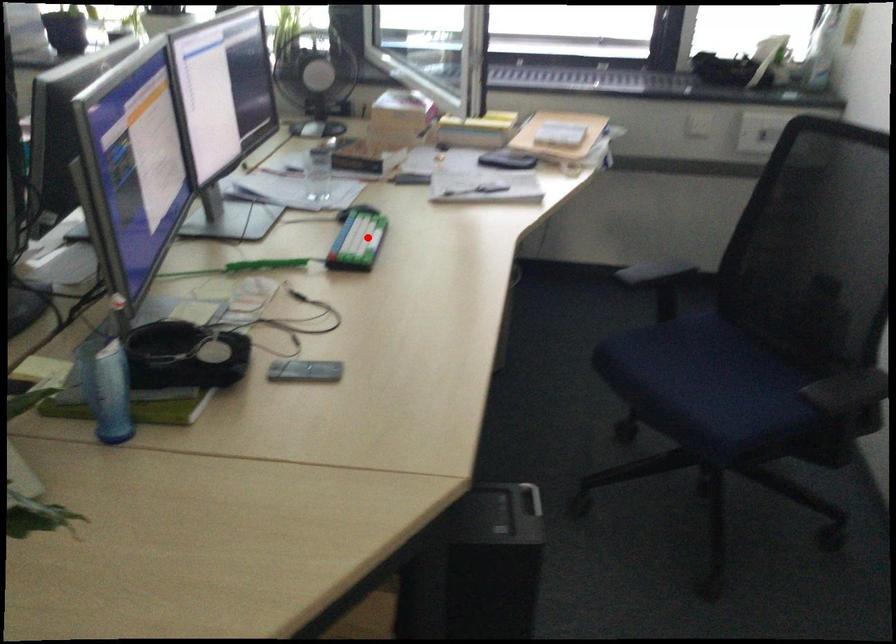
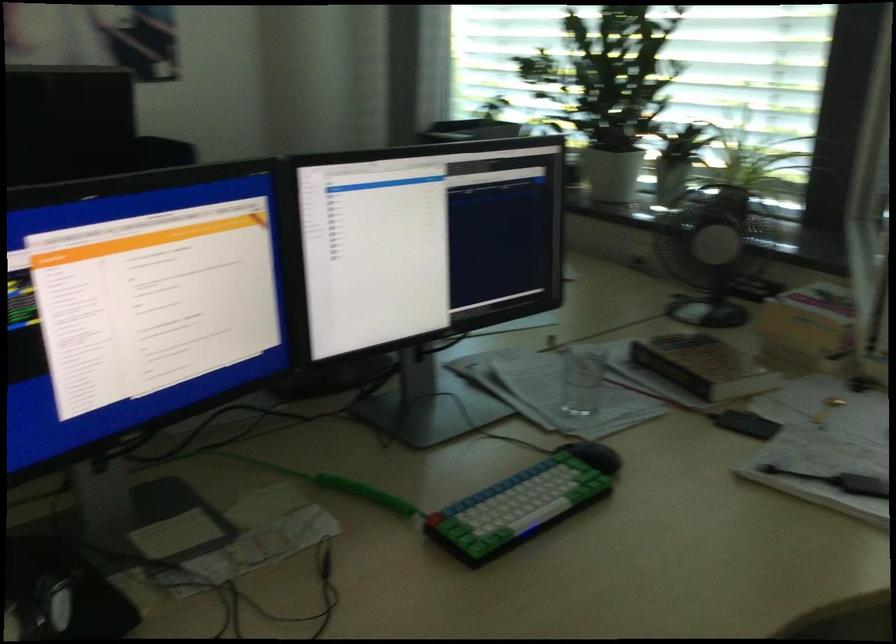
Question: A red point is marked in image1. In image2, is the corresponding 3D point closer to the camera or farther? Reply with the corresponding letter.

Choices:
 (A) The corresponding 3D point is closer.
 (B) The corresponding 3D point is farther.

Answer: (A)